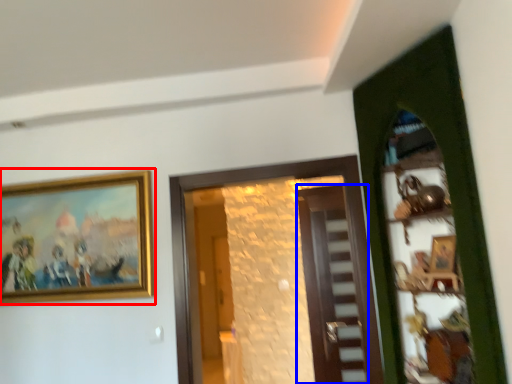
Question: Which object appears farthest to the camera in this image, picture frame (highlighted by a red box) or door (highlighted by a blue box)?

Choices:
 (A) picture frame
 (B) door

Answer: (B)